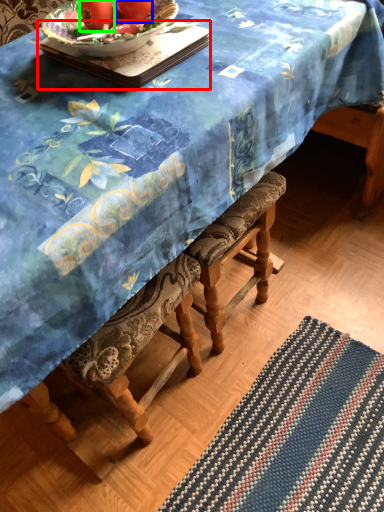
Question: Based on their relative distances, which object is farther from tray (highlighted by a red box)? Choose from tomato (highlighted by a blue box) and tomato (highlighted by a green box).

Choices:
 (A) tomato
 (B) tomato

Answer: (B)